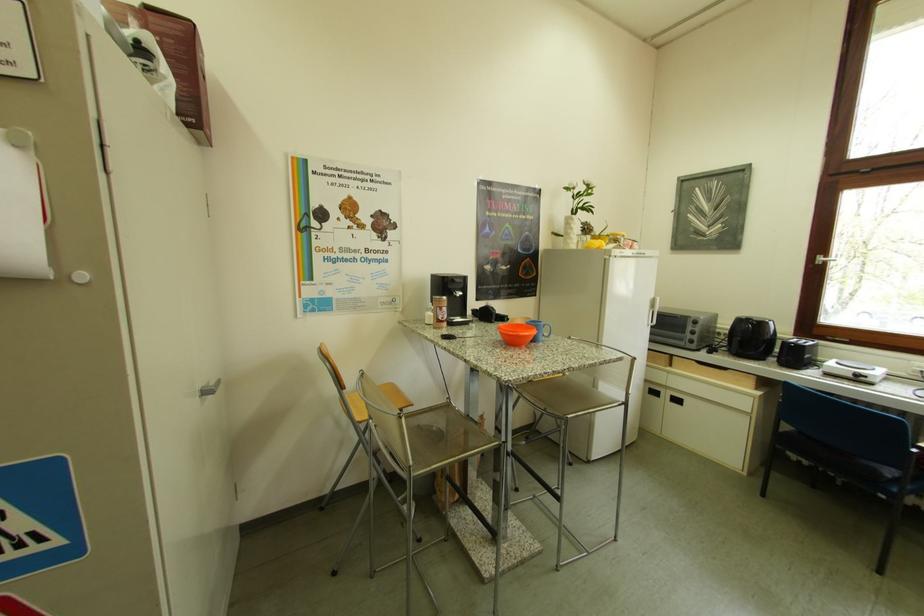
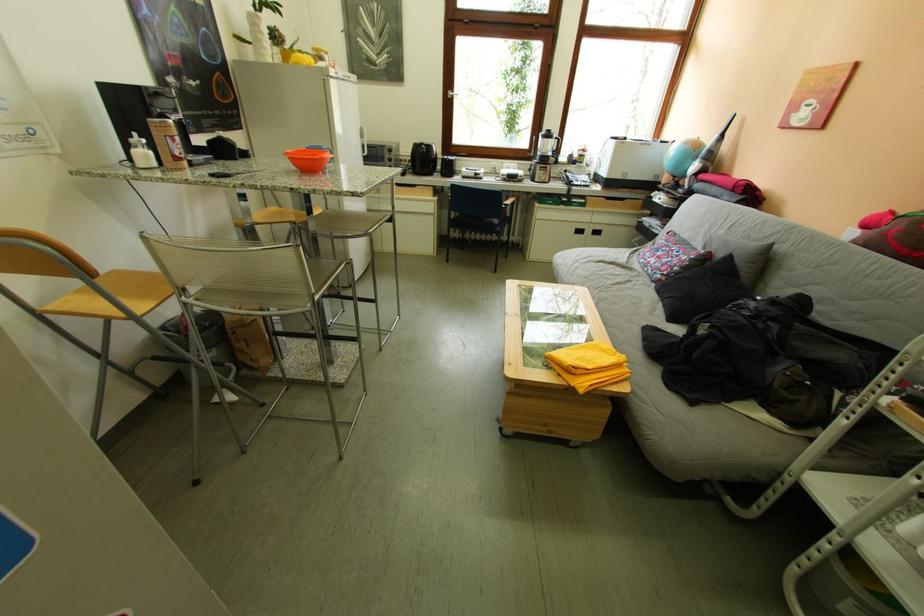
Locate, in the second image, the point that corresponds to point (895, 499) in the first image.

(507, 238)